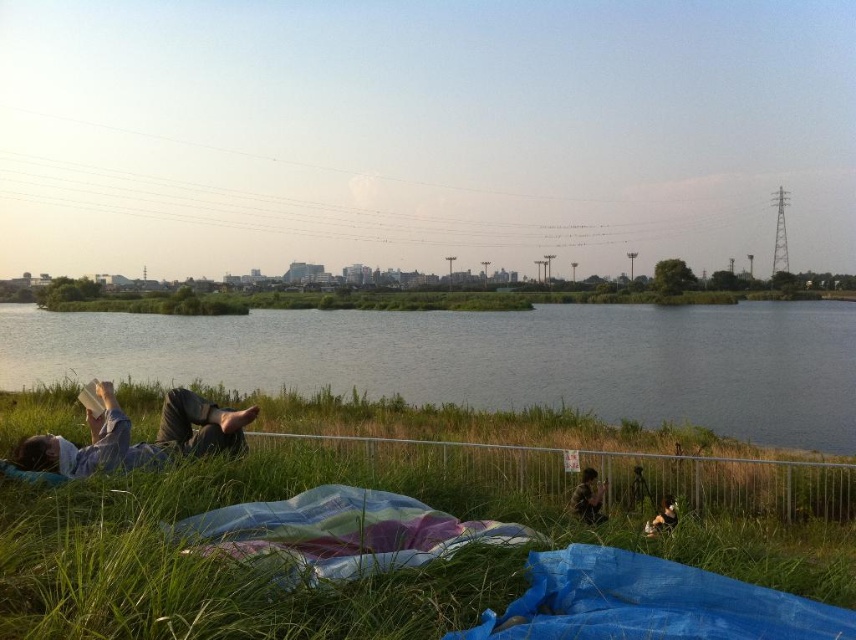
Consider the image. How much distance is there between multicolored fabric blanket at center and camouflage fabric jacket at lower right?

A distance of 6.57 meters exists between multicolored fabric blanket at center and camouflage fabric jacket at lower right.

Based on the photo, between multicolored fabric blanket at center and camouflage fabric jacket at lower right, which one has more height?

Standing taller between the two is camouflage fabric jacket at lower right.

Is point (453, 540) behind point (583, 483)?

No, it is not.

Locate an element on the screen. multicolored fabric blanket at center is located at coordinates (342, 532).

Is green grassy at lower left to the right of fluffy brown dog at lower right from the viewer's perspective?

No, green grassy at lower left is not to the right of fluffy brown dog at lower right.

Is point (311, 621) closer to viewer compared to point (670, 506)?

Yes, it is in front of point (670, 506).

Find the location of a particular element. green grassy at lower left is located at coordinates (x=321, y=588).

Can you confirm if green grassy at lower left is positioned above camouflage fabric jacket at lower right?

Indeed, green grassy at lower left is positioned over camouflage fabric jacket at lower right.

Between green grassy at lower left and camouflage fabric jacket at lower right, which one is positioned lower?

camouflage fabric jacket at lower right is lower down.

The width and height of the screenshot is (856, 640). In order to click on green grassy at lower left in this screenshot , I will do `click(321, 588)`.